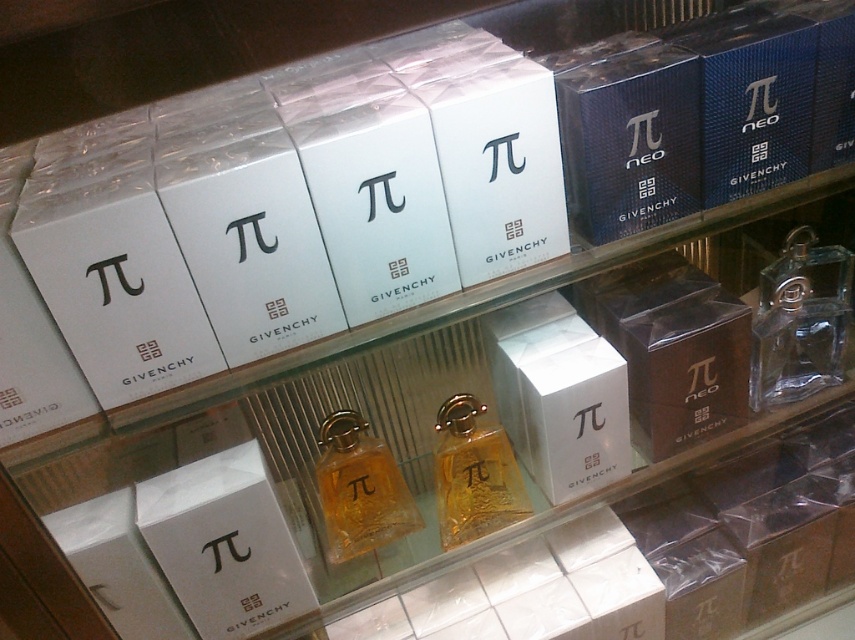
Question: Which of the following is the farthest from the observer?

Choices:
 (A) golden glass perfume at center
 (B) clear glass perfume at center
 (C) translucent amber glass perfume at center

Answer: (B)

Question: Which point is closer to the camera taking this photo?

Choices:
 (A) (788, 337)
 (B) (461, 506)
 (C) (364, 440)

Answer: (C)

Question: Observing the image, what is the correct spatial positioning of translucent amber glass perfume at center in reference to golden glass perfume at center?

Choices:
 (A) right
 (B) left

Answer: (B)

Question: Which point is closer to the camera?

Choices:
 (A) (764, 269)
 (B) (469, 528)

Answer: (B)

Question: Can you confirm if translucent amber glass perfume at center is positioned to the right of golden glass perfume at center?

Choices:
 (A) yes
 (B) no

Answer: (B)

Question: Does translucent amber glass perfume at center appear under golden glass perfume at center?

Choices:
 (A) no
 (B) yes

Answer: (B)